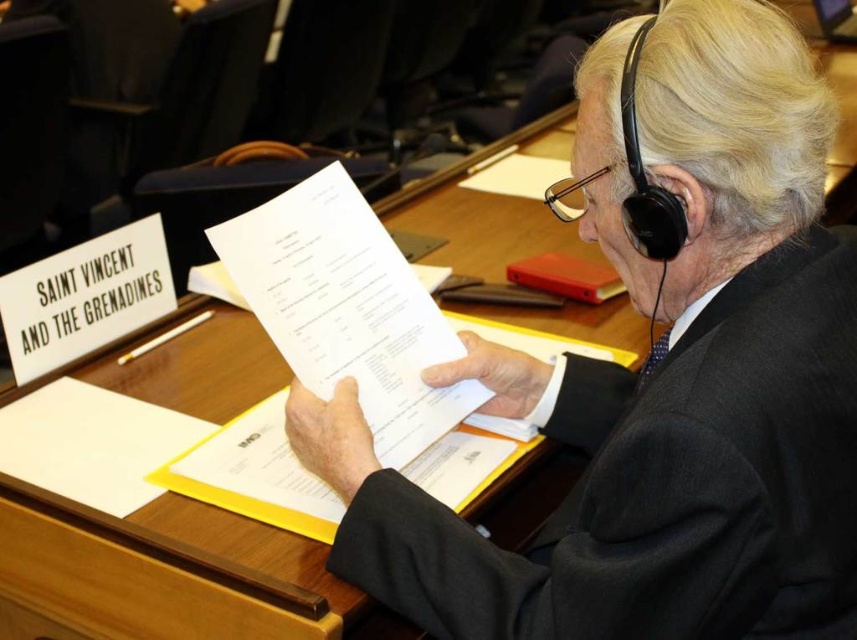
Can you confirm if black matte suit at center is shorter than wooden table at center?

Indeed, black matte suit at center has a lesser height compared to wooden table at center.

Who is more forward, (651, 412) or (171, 387)?

Point (651, 412)

Does point (450, 596) lie in front of point (172, 589)?

That is True.

Image resolution: width=857 pixels, height=640 pixels. In order to click on black matte suit at center in this screenshot , I will do `click(658, 378)`.

Does black matte suit at center have a lesser width compared to white paper at center?

Incorrect, black matte suit at center's width is not less than white paper at center's.

You are a GUI agent. You are given a task and a screenshot of the screen. Output one action in this format:
    pyautogui.click(x=<x>, y=<y>)
    Task: Click on the black matte suit at center
    This screenshot has height=640, width=857.
    Given the screenshot: What is the action you would take?
    pyautogui.click(x=658, y=378)

Is wooden table at center wider than white paper at center?

Yes, wooden table at center is wider than white paper at center.

Is wooden table at center shorter than white paper at center?

No.

Does point (558, 451) come behind point (346, 211)?

Yes.

In order to click on wooden table at center in this screenshot , I will do `click(169, 576)`.